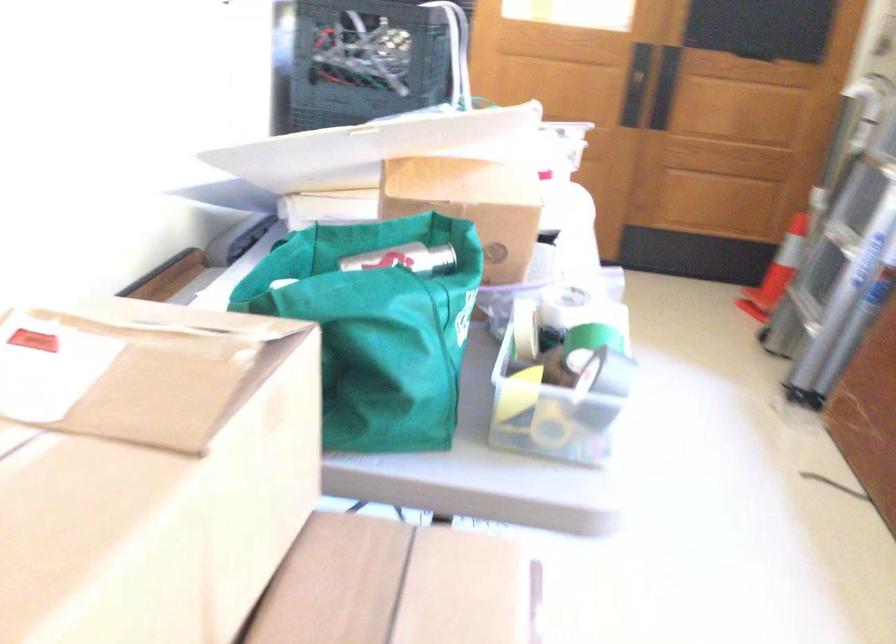
Identify the location of green tote bag. The height and width of the screenshot is (644, 896). (376, 326).